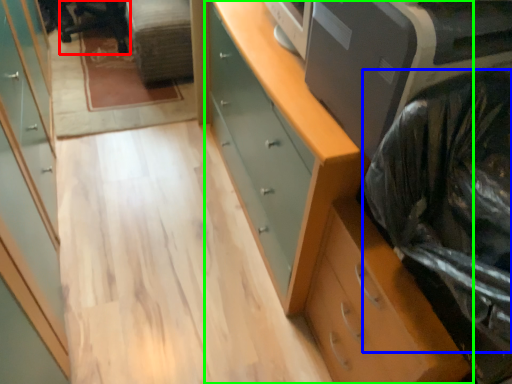
Question: Which object is the closest to the computer chair (highlighted by a red box)? Choose among these: garbage (highlighted by a blue box) or chest of drawers (highlighted by a green box).

Choices:
 (A) garbage
 (B) chest of drawers

Answer: (B)